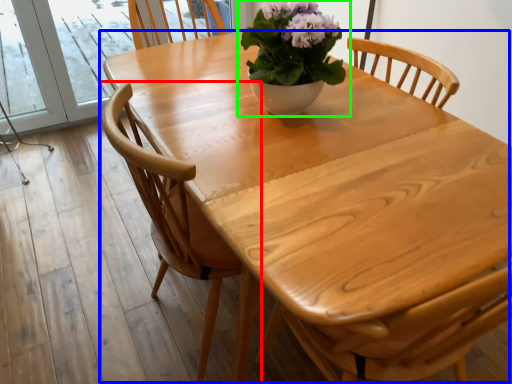
Question: Which object is the farthest from chair (highlighted by a red box)? Choose among these: kitchen & dining room table (highlighted by a blue box) or houseplant (highlighted by a green box).

Choices:
 (A) kitchen & dining room table
 (B) houseplant

Answer: (B)